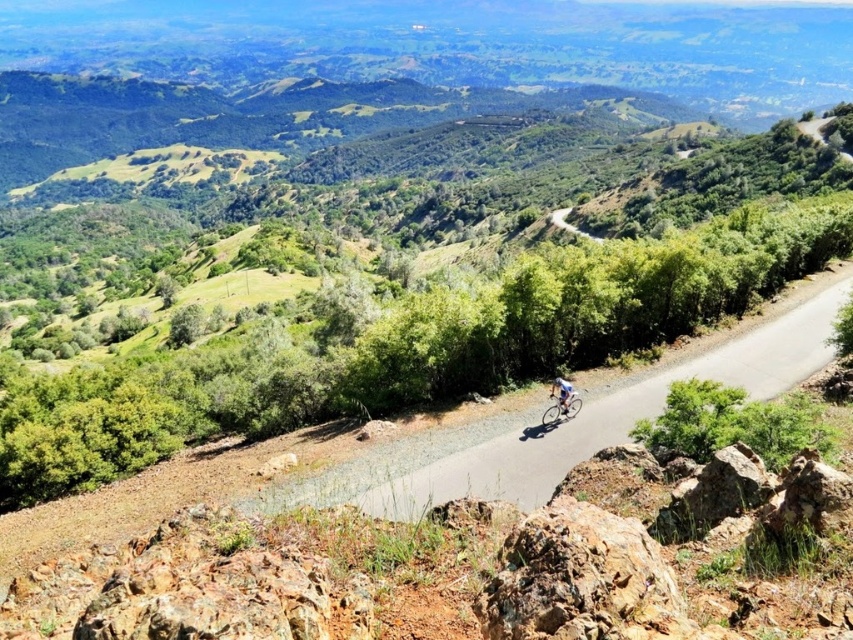
Question: Where is asphalt road at center located in relation to shiny blue frame at center in the image?

Choices:
 (A) right
 (B) left

Answer: (A)

Question: Which object appears farthest from the camera in this image?

Choices:
 (A) shiny blue frame at center
 (B) asphalt road at center
 (C) light blue fabric cyclist at center

Answer: (A)

Question: Can you confirm if asphalt road at center is smaller than light blue fabric cyclist at center?

Choices:
 (A) no
 (B) yes

Answer: (A)

Question: Estimate the real-world distances between objects in this image. Which object is farther from the shiny blue frame at center?

Choices:
 (A) light blue fabric cyclist at center
 (B) asphalt road at center

Answer: (B)

Question: Does shiny blue frame at center have a greater width compared to light blue fabric cyclist at center?

Choices:
 (A) yes
 (B) no

Answer: (A)

Question: Which object is closer to the camera taking this photo?

Choices:
 (A) light blue fabric cyclist at center
 (B) shiny blue frame at center

Answer: (A)